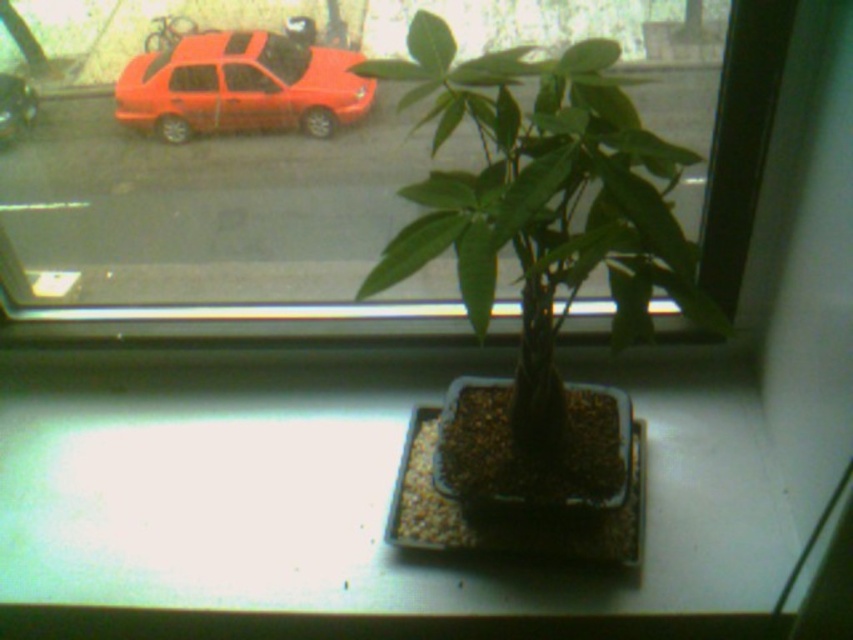
You are a gardener looking at the windowsill setup. Can you see the metallic red car at upper left through the green matte plant at center?

The green matte plant at center is in front of the metallic red car at upper left, so yes, you can see the metallic red car at upper left through the green matte plant at center because the plant is positioned in front but does not fully block the view.

You are a delivery person trying to determine if the green matte plant at center can fit through a doorway that is the same width as the metallic red car at upper left. Can it fit?

The green matte plant at center is wider than the metallic red car at upper left, so it cannot fit through the doorway.